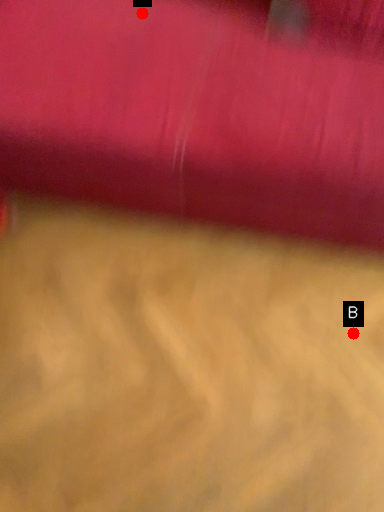
Question: Two points are circled on the image, labeled by A and B beside each circle. Which point appears closest to the camera in this image?

Choices:
 (A) A is closer
 (B) B is closer

Answer: (B)